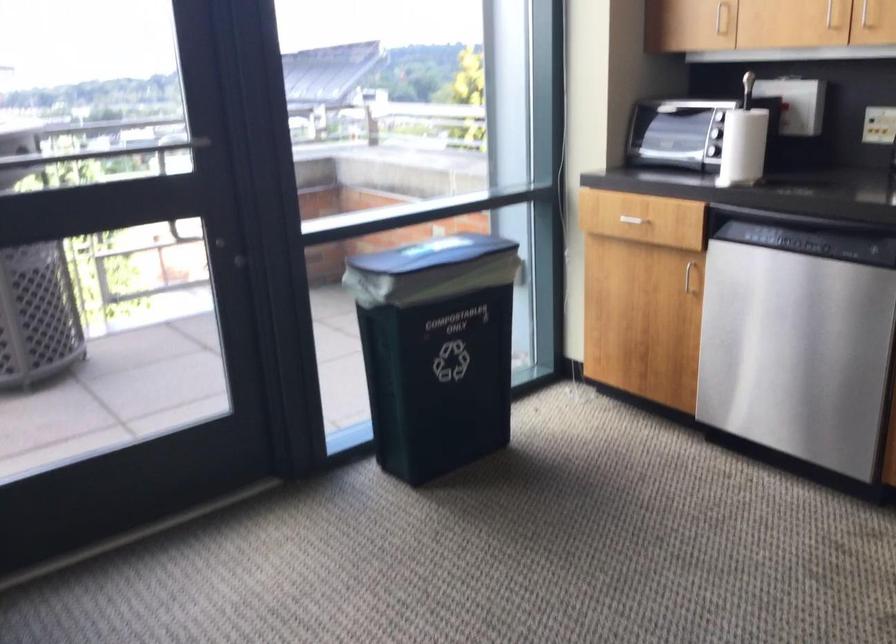
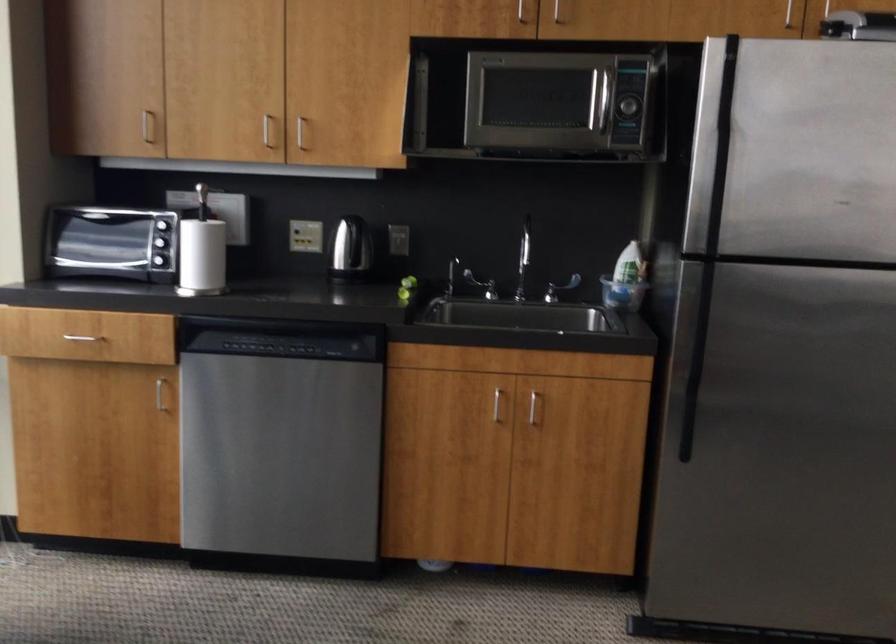
Locate, in the second image, the point that corresponds to point (733, 172) in the first image.

(202, 281)